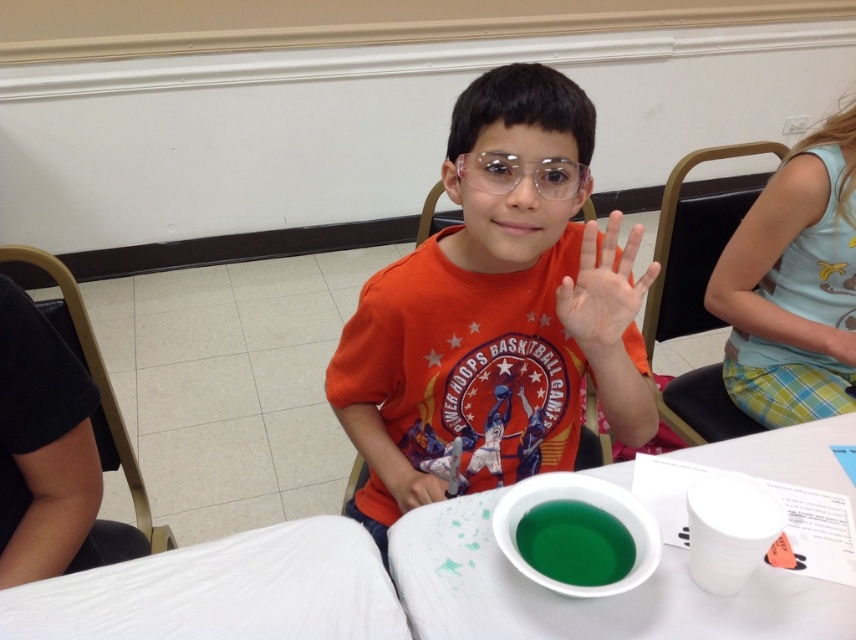
Question: Can you confirm if white plastic bowl at center is positioned below matte orange shirt at center?

Choices:
 (A) yes
 (B) no

Answer: (A)

Question: Which point appears closest to the camera in this image?

Choices:
 (A) (649, 394)
 (B) (49, 324)
 (C) (591, 513)
 (D) (403, 484)

Answer: (C)

Question: Does orange cotton shirt at center appear over matte orange shirt at center?

Choices:
 (A) yes
 (B) no

Answer: (A)

Question: Which point is closer to the camera taking this photo?

Choices:
 (A) pyautogui.click(x=103, y=540)
 (B) pyautogui.click(x=770, y=593)
 (C) pyautogui.click(x=409, y=481)

Answer: (B)

Question: Which object is the closest to the pale skin hand at center?

Choices:
 (A) black fabric at left
 (B) orange cotton shirt at center

Answer: (B)

Question: Is orange cotton shirt at center positioned at the back of white plastic bowl at center?

Choices:
 (A) yes
 (B) no

Answer: (A)